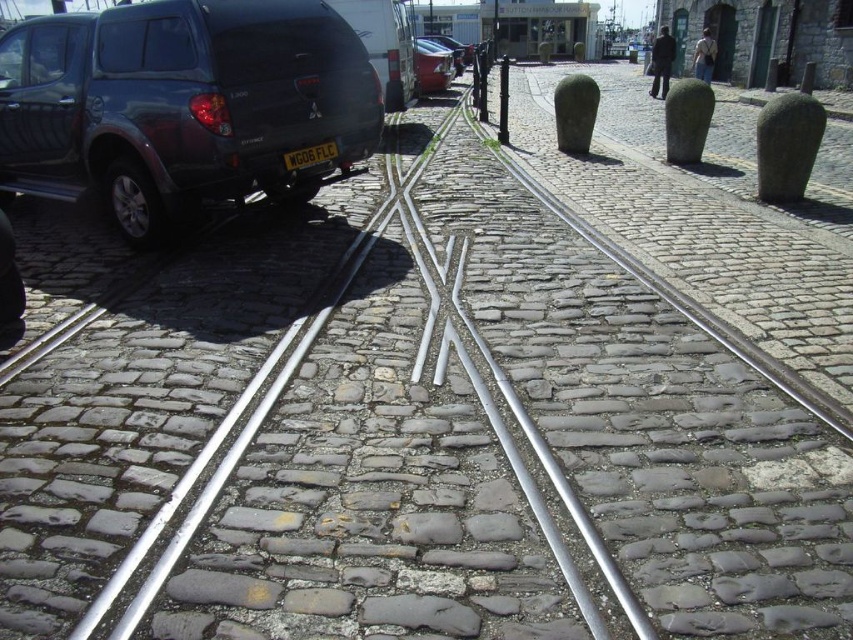
Does point (506, 100) come farther from viewer compared to point (450, 45)?

No, it is not.

Who is lower down, metallic pole at center or metallic red car at center?

metallic pole at center is below.

You are a GUI agent. You are given a task and a screenshot of the screen. Output one action in this format:
    pyautogui.click(x=<x>, y=<y>)
    Task: Click on the metallic pole at center
    The height and width of the screenshot is (640, 853).
    Given the screenshot: What is the action you would take?
    pyautogui.click(x=503, y=100)

Is the position of shiny red car at center less distant than that of metallic pole at center?

No.

This screenshot has height=640, width=853. What do you see at coordinates (431, 67) in the screenshot?
I see `shiny red car at center` at bounding box center [431, 67].

The height and width of the screenshot is (640, 853). What are the coordinates of `shiny red car at center` in the screenshot? It's located at (431, 67).

Is shiny red car at center wider than metallic red car at center?

No.

Can you confirm if shiny red car at center is positioned above metallic red car at center?

No, shiny red car at center is not above metallic red car at center.

The height and width of the screenshot is (640, 853). Find the location of `shiny red car at center`. shiny red car at center is located at coordinates 431,67.